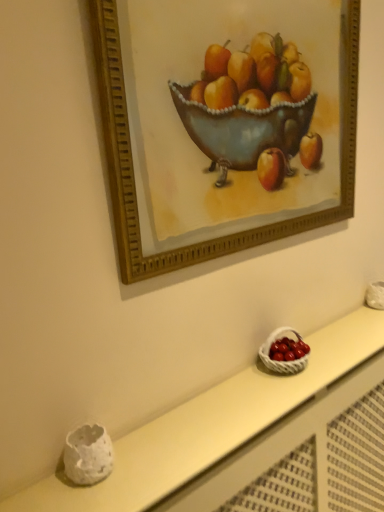
Describe the element at coordinates (281, 360) in the screenshot. The height and width of the screenshot is (512, 384). I see `white wicker basket at lower right` at that location.

Locate an element on the screen. This screenshot has width=384, height=512. white wicker basket at lower right is located at coordinates (281, 360).

Looking at this image, which object is further away from the camera, white wicker basket at lower right or gold-framed picture at upper center?

gold-framed picture at upper center is further from the camera.

In the image, is white wicker basket at lower right on the left side or the right side of gold-framed picture at upper center?

Based on their positions, white wicker basket at lower right is located to the right of gold-framed picture at upper center.

From the image's perspective, is white wicker basket at lower right below gold-framed picture at upper center?

Yes.

The image size is (384, 512). Identify the location of picture frame that is above the white wicker basket at lower right (from a real-world perspective). (224, 123).

Does point (286, 328) come farther from viewer compared to point (113, 503)?

Yes, point (286, 328) is farther from viewer.

Is white wicker basket at lower right positioned beyond the bounds of white wicker basket at lower right?

Yes.

From a real-world perspective, relative to white wicker basket at lower right, is white wicker basket at lower right vertically above or below?

white wicker basket at lower right is situated higher than white wicker basket at lower right in the real world.

Is gold-framed picture at upper center at the right side of white wicker basket at lower right?

No.

Is gold-framed picture at upper center positioned far away from white wicker basket at lower right?

That's not correct — gold-framed picture at upper center is a little close to white wicker basket at lower right.

Can you confirm if gold-framed picture at upper center is thinner than white wicker basket at lower right?

Indeed, gold-framed picture at upper center has a lesser width compared to white wicker basket at lower right.

Which object is further away from the camera taking this photo, gold-framed picture at upper center or white wicker basket at lower right?

white wicker basket at lower right is further from the camera.

In the scene shown: Measure the distance from gold-framed picture at upper center to white wicker basket at lower right.

gold-framed picture at upper center and white wicker basket at lower right are 22.55 inches apart from each other.

From the image's perspective, is gold-framed picture at upper center above white wicker basket at lower right?

Yes, from the image's perspective, gold-framed picture at upper center is above white wicker basket at lower right.

Identify the location of picture frame that appears on the left of white wicker basket at lower right. (224, 123).

In terms of size, does gold-framed picture at upper center appear bigger or smaller than white wicker basket at lower right?

gold-framed picture at upper center is smaller than white wicker basket at lower right.

Identify the location of picture frame on the left of white wicker basket at lower right. (224, 123).

Could you tell me if white wicker basket at lower right is turned towards gold-framed picture at upper center?

No, white wicker basket at lower right is not facing towards gold-framed picture at upper center.

Is white wicker basket at lower right outside of gold-framed picture at upper center?

white wicker basket at lower right is positioned outside gold-framed picture at upper center.

From the image's perspective, does white wicker basket at lower right appear higher than white wicker basket at lower right?

No, from the image's perspective, white wicker basket at lower right is not on top of white wicker basket at lower right.

Would you consider white wicker basket at lower right to be distant from white wicker basket at lower right?

Actually, white wicker basket at lower right and white wicker basket at lower right are a little close together.

Do you think white wicker basket at lower right is within white wicker basket at lower right, or outside of it?

white wicker basket at lower right is outside white wicker basket at lower right.

Locate an element on the screen. table on the right side of gold-framed picture at upper center is located at coordinates (209, 425).

Identify the location of basket behind the white wicker basket at lower right. This screenshot has width=384, height=512. pyautogui.click(x=281, y=360).

Based on their spatial positions, is white wicker basket at lower right or gold-framed picture at upper center further from white wicker basket at lower right?

gold-framed picture at upper center is further to white wicker basket at lower right.

Which object lies further to the anchor point white wicker basket at lower right, white wicker basket at lower right or gold-framed picture at upper center?

Based on the image, gold-framed picture at upper center appears to be further to white wicker basket at lower right.

Which object lies further to the anchor point gold-framed picture at upper center, white wicker basket at lower right or white wicker basket at lower right?

Among the two, white wicker basket at lower right is located further to gold-framed picture at upper center.

Which object lies nearer to the anchor point gold-framed picture at upper center, white wicker basket at lower right or white wicker basket at lower right?

The object closer to gold-framed picture at upper center is white wicker basket at lower right.

When comparing their distances from white wicker basket at lower right, does gold-framed picture at upper center or white wicker basket at lower right seem closer?

white wicker basket at lower right is closer to white wicker basket at lower right.

Based on the photo, from the image, which object appears to be nearer to white wicker basket at lower right, gold-framed picture at upper center or white wicker basket at lower right?

white wicker basket at lower right is positioned closer to the anchor white wicker basket at lower right.

The width and height of the screenshot is (384, 512). Identify the location of basket between gold-framed picture at upper center and white wicker basket at lower right vertically. (281, 360).